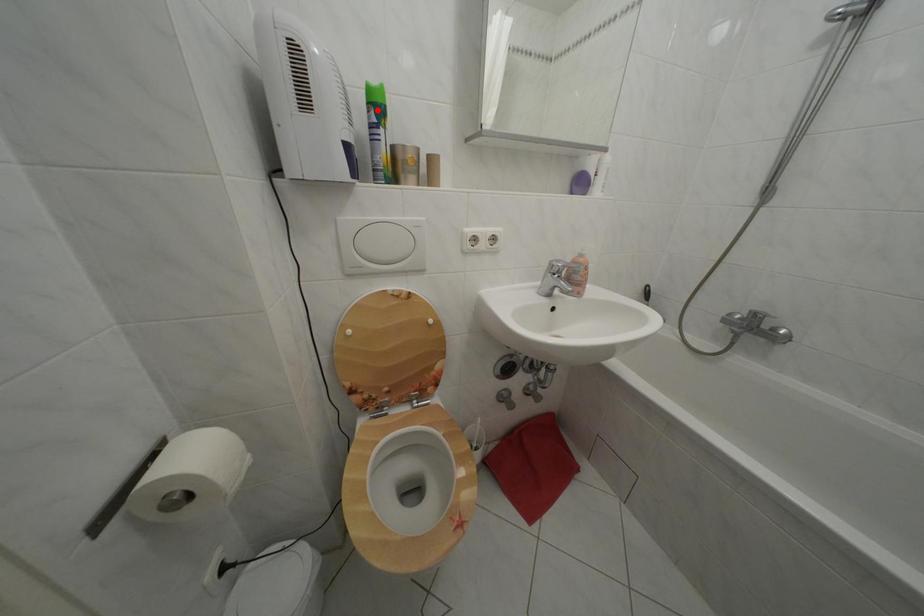
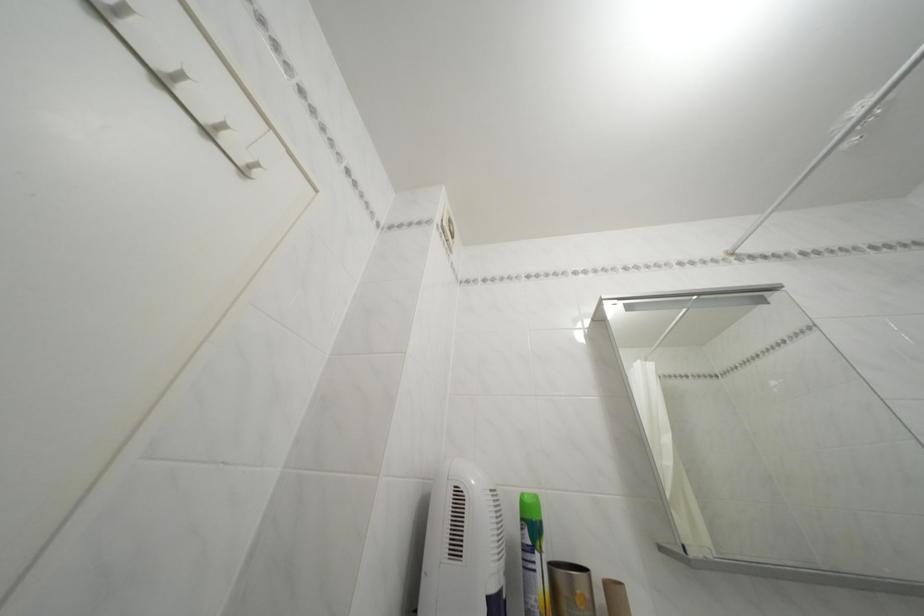
Locate, in the second image, the point that corresponds to the highlighted location in the first image.

(531, 525)